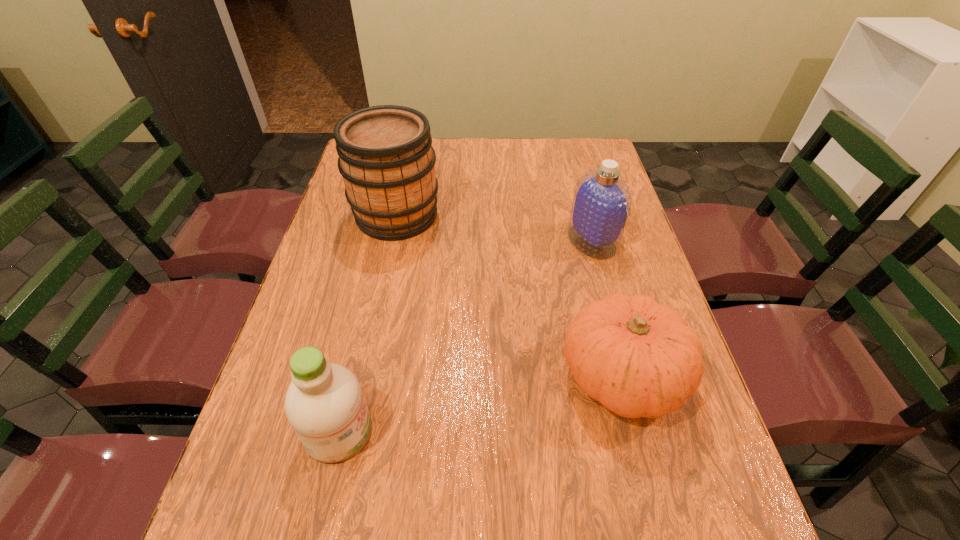
You are a GUI agent. You are given a task and a screenshot of the screen. Output one action in this format:
    pyautogui.click(x=<x>, y=<y>)
    Task: Click on the cleansing agent at the right edge
    Image resolution: width=960 pixels, height=540 pixels.
    Given the screenshot: What is the action you would take?
    pyautogui.click(x=601, y=204)

This screenshot has width=960, height=540. I want to click on pumpkin located at the right edge, so click(638, 358).

In the image, there is a desktop. In order to click on vacant space at the far edge in this screenshot , I will do `click(551, 164)`.

Locate an element on the screen. The height and width of the screenshot is (540, 960). free space at the left edge is located at coordinates (350, 281).

Where is `vacant space at the right edge of the desktop`? This screenshot has width=960, height=540. vacant space at the right edge of the desktop is located at coordinates (685, 429).

At what (x,y) coordinates should I click in order to perform the action: click on free space at the far right corner of the desktop. Please return your answer as a coordinate pair (x, y). This screenshot has height=540, width=960. Looking at the image, I should click on (583, 157).

Identify the location of empty space that is in between the nearer cleansing agent and the cider. The width and height of the screenshot is (960, 540). (368, 323).

Find the location of `free space between the nearer cleansing agent and the right cleansing agent`. free space between the nearer cleansing agent and the right cleansing agent is located at coordinates (466, 336).

Find the location of a particular element. The width and height of the screenshot is (960, 540). free space between the cider and the left cleansing agent is located at coordinates (368, 323).

The image size is (960, 540). In order to click on unoccupied position between the left cleansing agent and the pumpkin in this screenshot , I will do `click(480, 403)`.